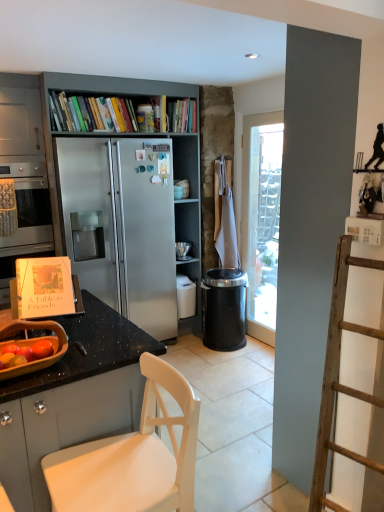
Describe the element at coordinates (28, 206) in the screenshot. I see `stainless steel oven at left` at that location.

This screenshot has height=512, width=384. What do you see at coordinates (182, 116) in the screenshot?
I see `hardcover book at upper center, which ranks as the 2th book in left-to-right order` at bounding box center [182, 116].

The height and width of the screenshot is (512, 384). Identify the location of metallic gray bookcase at center. (130, 204).

This screenshot has width=384, height=512. What do you see at coordinates (130, 204) in the screenshot? I see `metallic gray bookcase at center` at bounding box center [130, 204].

Describe the element at coordinates (224, 309) in the screenshot. Image resolution: width=384 pixels, height=512 pixels. I see `black plastic trash can at center-right` at that location.

At what (x,y) coordinates should I click in order to perform the action: click on hardcover books at upper center, the first book viewed from the left. Please return your answer as a coordinate pair (x, y). Looking at the image, I should click on (122, 114).

Image resolution: width=384 pixels, height=512 pixels. I want to click on white matte chair at lower left, so click(133, 457).

Where is `stainless steel oven at left`? This screenshot has height=512, width=384. stainless steel oven at left is located at coordinates (28, 206).

Between metallic gray bookcase at center and black granite countertop at lower left, which one has smaller size?

black granite countertop at lower left is smaller.

Identify the location of bookcase behind the black granite countertop at lower left. The width and height of the screenshot is (384, 512). (130, 204).

Would you consider metallic gray bookcase at center to be distant from black granite countertop at lower left?

metallic gray bookcase at center is positioned a significant distance from black granite countertop at lower left.

Considering the points (106, 185) and (120, 390), which point is behind, point (106, 185) or point (120, 390)?

The point (106, 185) is behind.

Would you say black granite countertop at lower left is a long distance from metallic gray bookcase at center?

Yes, black granite countertop at lower left and metallic gray bookcase at center are located far from each other.

Looking at the image, does black granite countertop at lower left seem bigger or smaller compared to metallic gray bookcase at center?

In the image, black granite countertop at lower left appears to be smaller than metallic gray bookcase at center.

Based on the photo, is the position of black granite countertop at lower left more distant than that of metallic gray bookcase at center?

No, it is not.

From the image's perspective, does black granite countertop at lower left appear lower than metallic gray bookcase at center?

Correct, black granite countertop at lower left appears lower than metallic gray bookcase at center in the image.

From a real-world perspective, is black plastic trash can at center-right over black glossy shelf at upper right?

Actually, black plastic trash can at center-right is physically below black glossy shelf at upper right in the real world.

Image resolution: width=384 pixels, height=512 pixels. What are the coordinates of `trash bin/can that is behind the black glossy shelf at upper right` in the screenshot? It's located at (224, 309).

Does black plastic trash can at center-right have a larger size compared to black glossy shelf at upper right?

Yes, black plastic trash can at center-right is bigger than black glossy shelf at upper right.

Between point (217, 275) and point (361, 186), which one is positioned behind?

The point (217, 275) is more distant.

How distant is black glossy shelf at upper right from white matte chair at lower left?

A distance of 1.13 meters exists between black glossy shelf at upper right and white matte chair at lower left.

Looking at this image, is black glossy shelf at upper right facing away from white matte chair at lower left?

black glossy shelf at upper right does not have its back to white matte chair at lower left.

Is point (360, 207) positioned after point (123, 495)?

Yes, point (360, 207) is behind point (123, 495).

Which object is positioned more to the right, metallic gray bookcase at center or black plastic trash can at center-right?

From the viewer's perspective, black plastic trash can at center-right appears more on the right side.

Does metallic gray bookcase at center come behind black plastic trash can at center-right?

No.

From a real-world perspective, is metallic gray bookcase at center physically below black plastic trash can at center-right?

Incorrect, from a real-world perspective, metallic gray bookcase at center is higher than black plastic trash can at center-right.

Is metallic gray bookcase at center oriented towards black plastic trash can at center-right?

Yes, metallic gray bookcase at center is facing black plastic trash can at center-right.

Considering the relative sizes of black plastic trash can at center-right and hardcover book at upper center, which ranks as the 2th book in left-to-right order, in the image provided, is black plastic trash can at center-right wider than hardcover book at upper center, which ranks as the 2th book in left-to-right order,?

Yes.

Is black plastic trash can at center-right completely or partially outside of hardcover book at upper center, which is the first book from right to left?

That's correct, black plastic trash can at center-right is outside of hardcover book at upper center, which is the first book from right to left.

Is there a large distance between black plastic trash can at center-right and hardcover book at upper center, which ranks as the 2th book in left-to-right order?

That's right, there is a large distance between black plastic trash can at center-right and hardcover book at upper center, which ranks as the 2th book in left-to-right order.

Does point (233, 320) come in front of point (155, 466)?

No, it is behind (155, 466).

Does black plastic trash can at center-right come behind white matte chair at lower left?

Yes, it is behind white matte chair at lower left.

Measure the distance between black plastic trash can at center-right and white matte chair at lower left.

A distance of 6.75 feet exists between black plastic trash can at center-right and white matte chair at lower left.

Where is `chair located below the black plastic trash can at center-right (from the image's perspective)`? chair located below the black plastic trash can at center-right (from the image's perspective) is located at coordinates (133, 457).

Find the location of a particular element. The height and width of the screenshot is (512, 384). bookcase located above the black granite countertop at lower left (from a real-world perspective) is located at coordinates (130, 204).

Image resolution: width=384 pixels, height=512 pixels. What are the coordinates of `countertop in front of the metallic gray bookcase at center` in the screenshot? It's located at (73, 398).

From the image, which object appears to be farther from metallic gray bookcase at center, black granite countertop at lower left or white matte chair at lower left?

Based on the image, white matte chair at lower left appears to be further to metallic gray bookcase at center.

Considering their positions, is black granite countertop at lower left positioned closer to metallic gray bookcase at center than stainless steel oven at left?

stainless steel oven at left lies closer to metallic gray bookcase at center than the other object.

From the image, which object appears to be nearer to white matte chair at lower left, black plastic trash can at center-right or black granite countertop at lower left?

The object closer to white matte chair at lower left is black granite countertop at lower left.

When comparing their distances from black granite countertop at lower left, does metallic gray bookcase at center or black plastic trash can at center-right seem closer?

metallic gray bookcase at center.

From the image, which object appears to be farther from black glossy shelf at upper right, hardcover books at upper center, the 2th book in the right-to-left sequence, or black plastic trash can at center-right?

hardcover books at upper center, the 2th book in the right-to-left sequence, lies further to black glossy shelf at upper right than the other object.

Looking at this image, looking at the image, which one is located further to white matte chair at lower left, metallic gray bookcase at center or black glossy shelf at upper right?

Among the two, metallic gray bookcase at center is located further to white matte chair at lower left.

Which object lies further to the anchor point black granite countertop at lower left, hardcover book at upper center, which is the first book from right to left, or black plastic trash can at center-right?

Based on the image, hardcover book at upper center, which is the first book from right to left, appears to be further to black granite countertop at lower left.

Looking at this image, estimate the real-world distances between objects in this image. Which object is further from stainless steel oven at left, black plastic trash can at center-right or white matte chair at lower left?

Based on the image, white matte chair at lower left appears to be further to stainless steel oven at left.

Find the location of a particular element. bookcase between stainless steel oven at left and hardcover book at upper center, which ranks as the 2th book in left-to-right order is located at coordinates (130, 204).

I want to click on shelf between white matte chair at lower left and metallic gray bookcase at center along the z-axis, so click(369, 191).

The height and width of the screenshot is (512, 384). Identify the location of chair between stainless steel oven at left and black glossy shelf at upper right. (133, 457).

You are a GUI agent. You are given a task and a screenshot of the screen. Output one action in this format:
    pyautogui.click(x=<x>, y=<y>)
    Task: Click on the bookcase between black granite countertop at lower left and hardcover book at upper center, which ranks as the 2th book in left-to-right order, from front to back
    
    Given the screenshot: What is the action you would take?
    pyautogui.click(x=130, y=204)